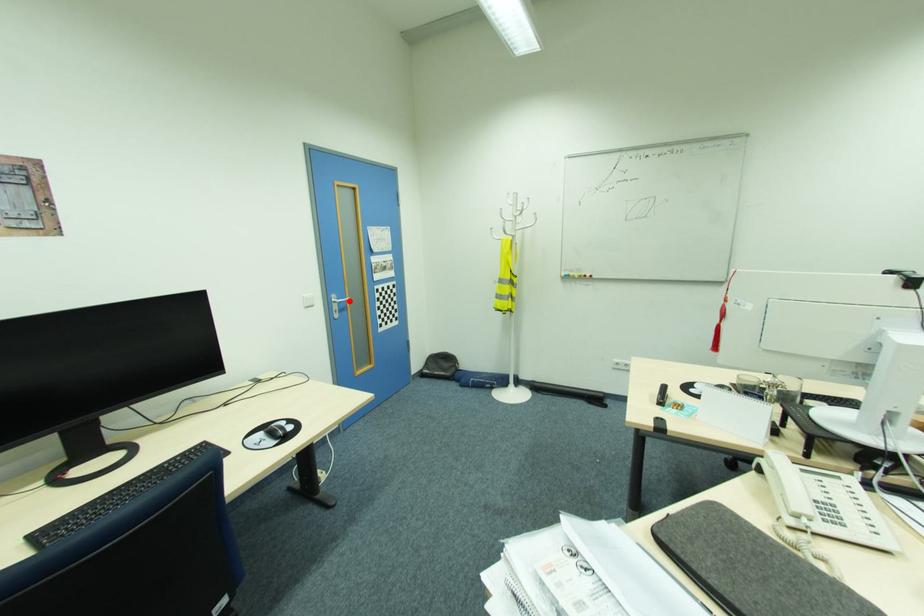
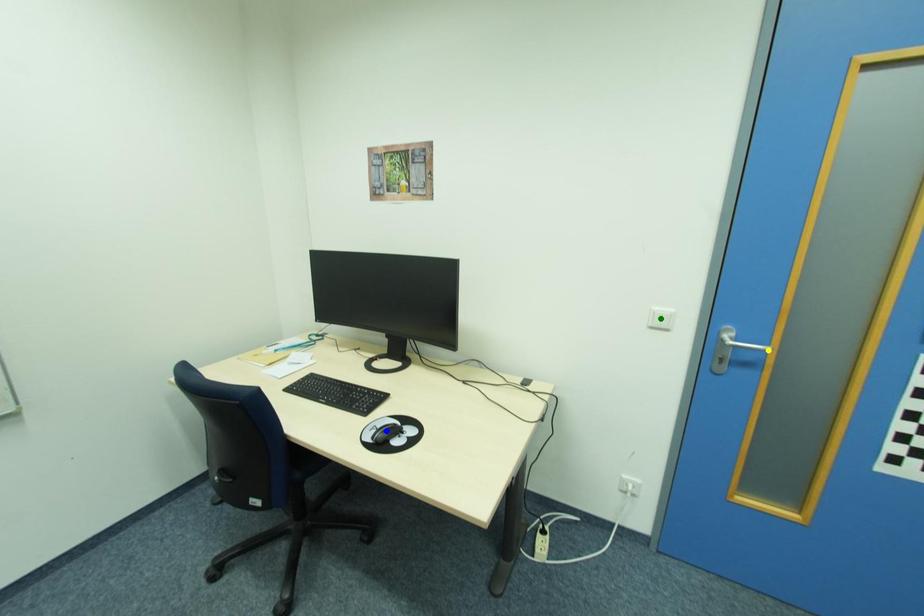
Question: I am providing you with two images of the same scene from different viewpoints. A red point is marked on the first image. You are given multiple points on the second image. In image 2, which mark is for the same physical point as the one in image 1?

Choices:
 (A) green point
 (B) blue point
 (C) yellow point

Answer: (C)